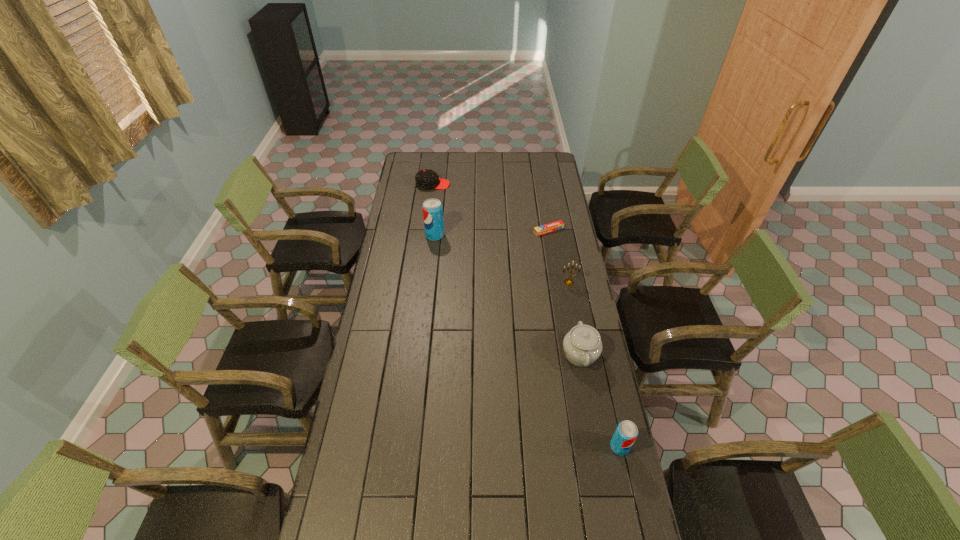
Locate an element on the screen. The image size is (960, 540). free spot located on the front of the right soda can is located at coordinates (635, 513).

You are a GUI agent. You are given a task and a screenshot of the screen. Output one action in this format:
    pyautogui.click(x=<x>, y=<y>)
    Task: Click on the free space located 0.320m on the left of the fourth farthest object
    
    Given the screenshot: What is the action you would take?
    pyautogui.click(x=489, y=282)

Find the location of a particular element. The height and width of the screenshot is (540, 960). vacant area situated on the front-facing side of the farthest object is located at coordinates (466, 185).

The width and height of the screenshot is (960, 540). What are the coordinates of `free space located 0.120m on the front of the toothpaste` in the screenshot? It's located at 552,253.

Find the location of `vacant space located 0.390m on the front of the chinaware`. vacant space located 0.390m on the front of the chinaware is located at coordinates (605, 486).

Identify the location of object present at the left edge. The width and height of the screenshot is (960, 540). (425, 179).

Where is `soda can present at the right edge`? The height and width of the screenshot is (540, 960). soda can present at the right edge is located at coordinates (626, 432).

This screenshot has height=540, width=960. Identify the location of candelabrum located at the right edge. (569, 282).

The width and height of the screenshot is (960, 540). Find the location of `toothpaste at the right edge`. toothpaste at the right edge is located at coordinates (550, 227).

Find the location of a particular element. The width and height of the screenshot is (960, 540). chinaware that is at the right edge is located at coordinates (582, 345).